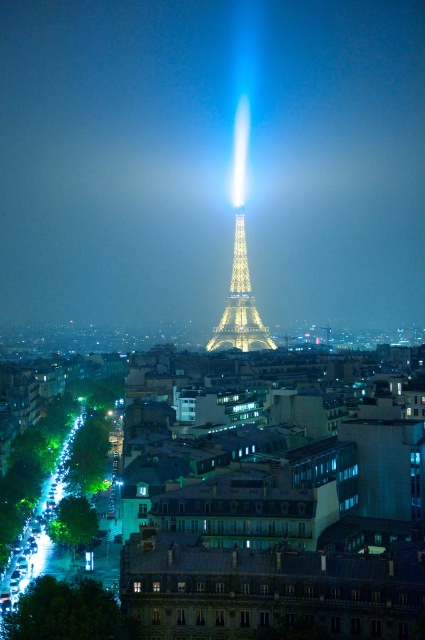
Question: Is the position of matte glass buildings at center more distant than that of illuminated steel eiffel tower at center?

Choices:
 (A) yes
 (B) no

Answer: (B)

Question: Which point is farther from the camera taking this photo?

Choices:
 (A) (251, 292)
 (B) (234, 548)

Answer: (A)

Question: Which point appears farthest from the camera in this image?

Choices:
 (A) (170, 490)
 (B) (232, 253)

Answer: (B)

Question: Is matte glass buildings at center thinner than illuminated steel eiffel tower at center?

Choices:
 (A) no
 (B) yes

Answer: (A)

Question: Does matte glass buildings at center appear on the left side of illuminated steel eiffel tower at center?

Choices:
 (A) no
 (B) yes

Answer: (A)